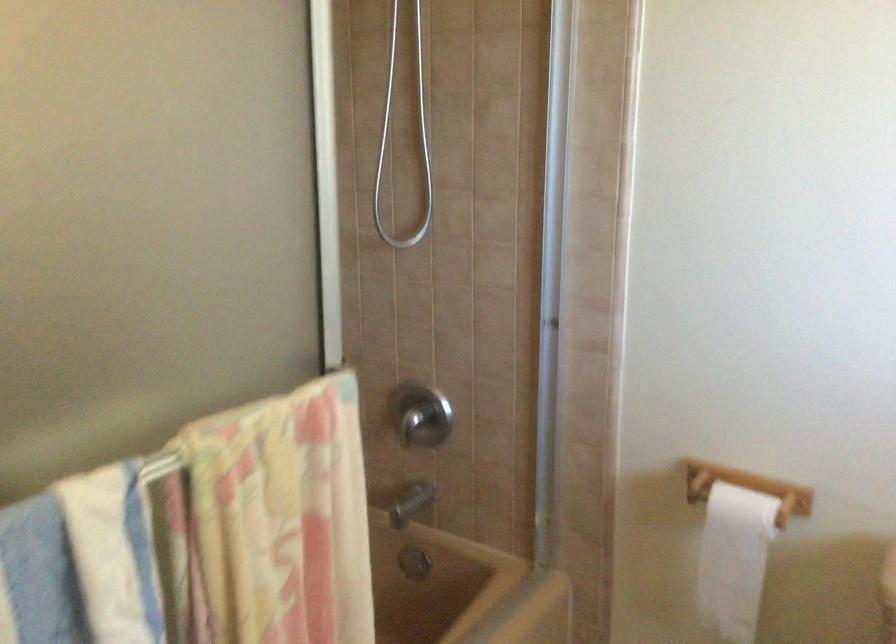
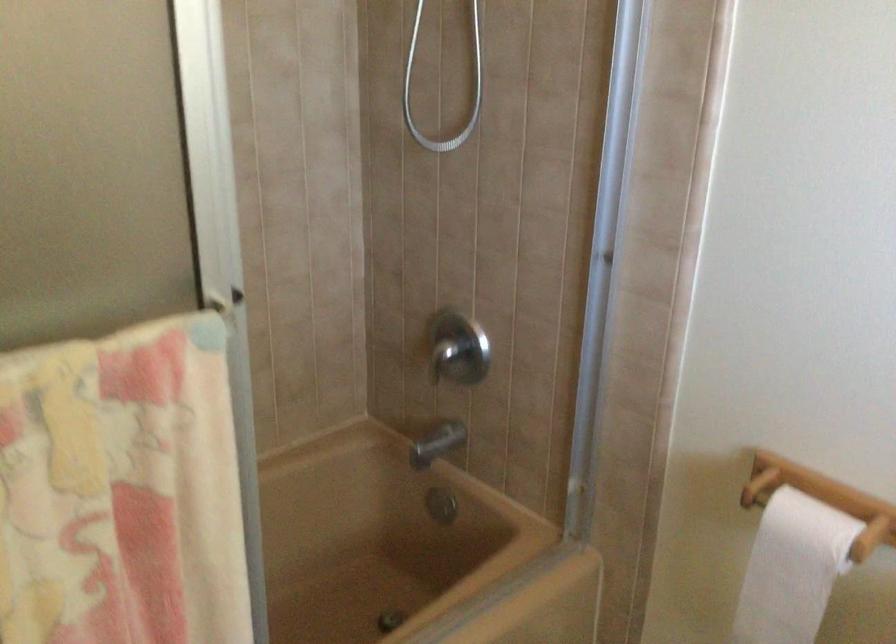
Question: The images are taken continuously from a first-person perspective. In which direction is your viewpoint rotating?

Choices:
 (A) Left
 (B) Right
 (C) Up
 (D) Down

Answer: (A)